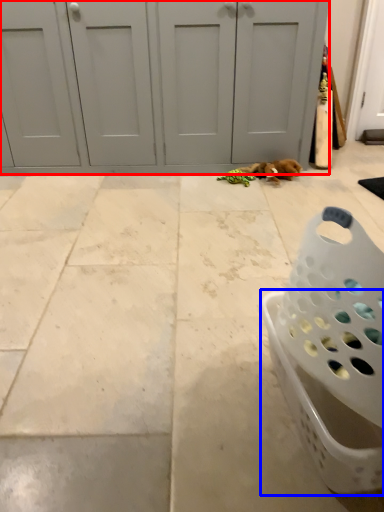
Question: Among these objects, which one is nearest to the camera, door (highlighted by a red box) or basket (highlighted by a blue box)?

Choices:
 (A) door
 (B) basket

Answer: (B)